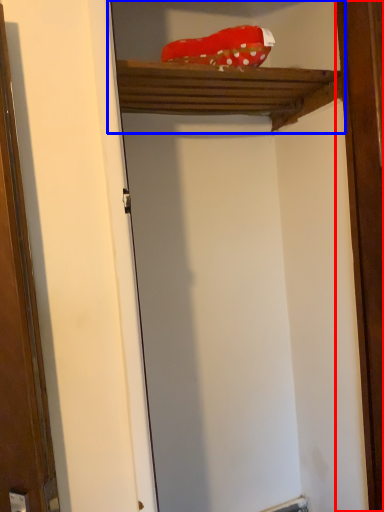
Question: Which object appears closest to the camera in this image, barn door (highlighted by a red box) or cabinet (highlighted by a blue box)?

Choices:
 (A) barn door
 (B) cabinet

Answer: (B)